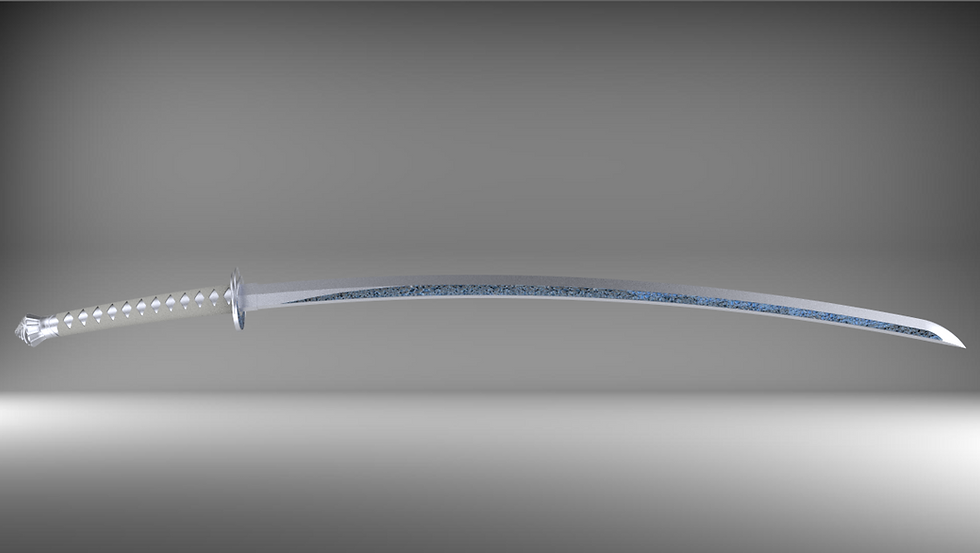
Identify the location of handle. This screenshot has height=553, width=980. (151, 309).